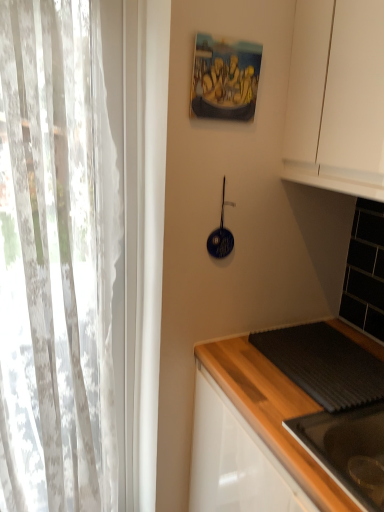
Question: Considering the positions of black glossy sink at lower right and white sheer curtain at left in the image, is black glossy sink at lower right taller or shorter than white sheer curtain at left?

Choices:
 (A) short
 (B) tall

Answer: (A)

Question: From a real-world perspective, relative to white sheer curtain at left, is black glossy sink at lower right vertically above or below?

Choices:
 (A) below
 (B) above

Answer: (A)

Question: Based on their relative distances, which object is nearer to the dark gray textured mat at lower right?

Choices:
 (A) white sheer curtain at left
 (B) black glossy sink at lower right
 (C) oil painting at upper center
 (D) blue glossy frying pan at upper center

Answer: (B)

Question: Considering the real-world distances, which object is farthest from the oil painting at upper center?

Choices:
 (A) blue glossy frying pan at upper center
 (B) white sheer curtain at left
 (C) dark gray textured mat at lower right
 (D) black glossy sink at lower right

Answer: (D)